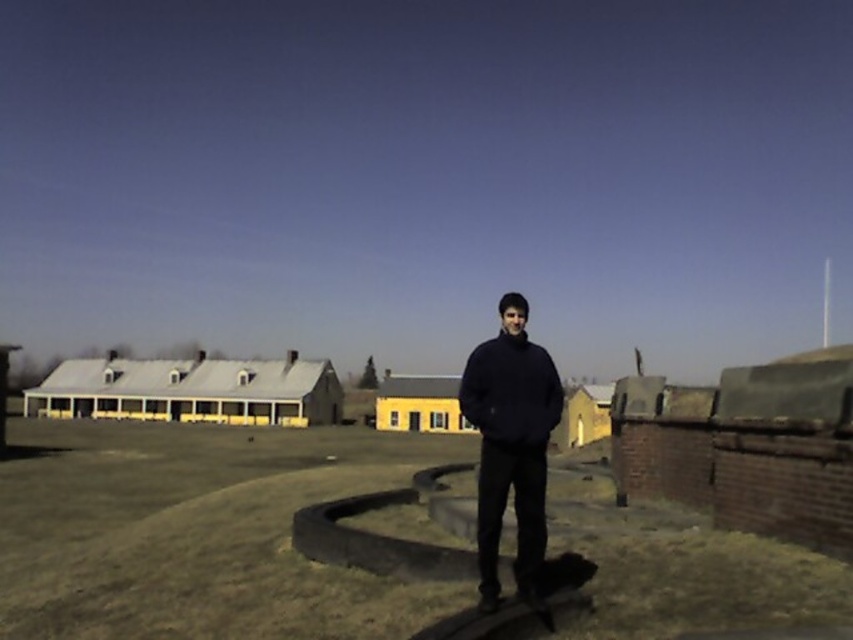
Does dark blue sweater at center have a greater height compared to black matte sweatshirt at center?

No, dark blue sweater at center is not taller than black matte sweatshirt at center.

Does dark blue sweater at center have a greater width compared to black matte sweatshirt at center?

No, dark blue sweater at center is not wider than black matte sweatshirt at center.

In order to click on dark blue sweater at center in this screenshot , I will do `click(509, 444)`.